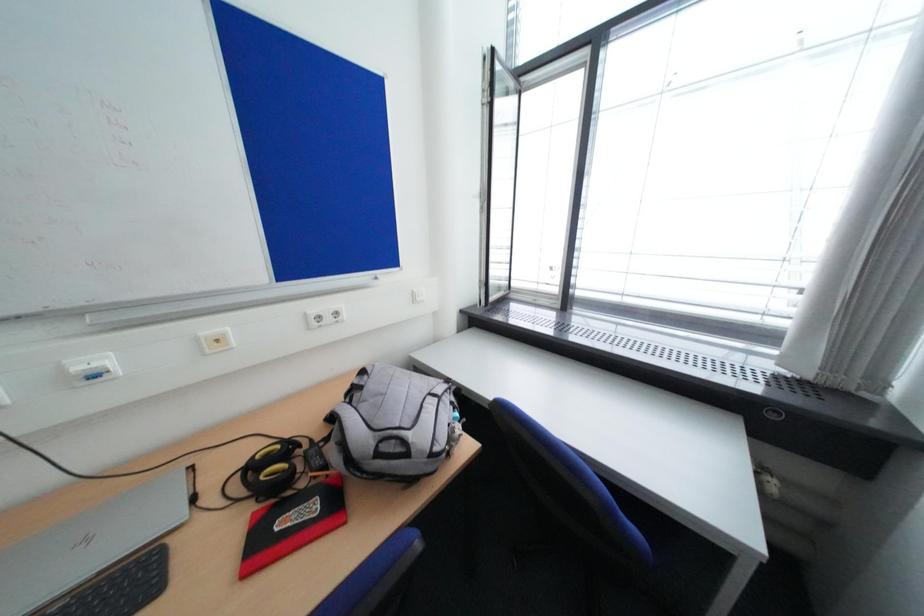
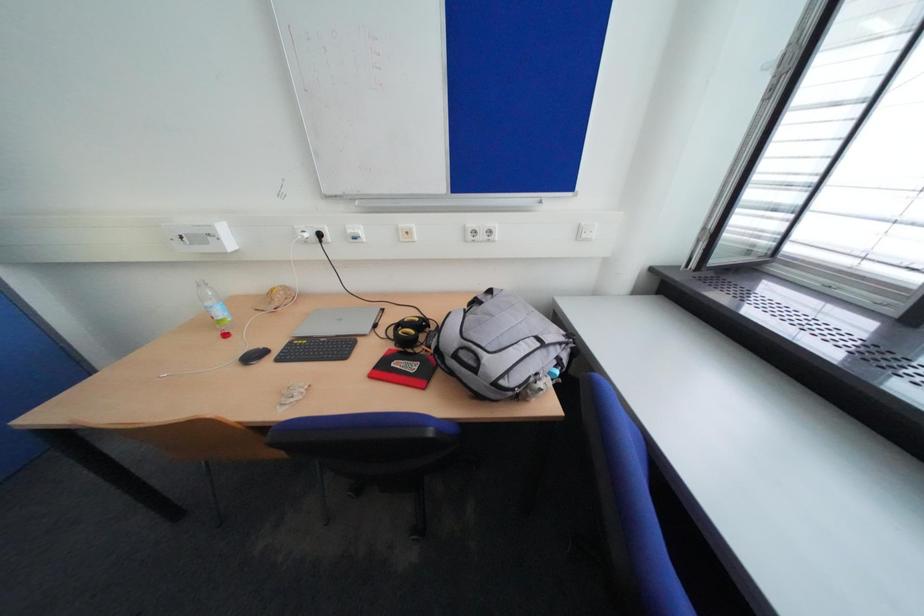
Based on the photo, based on the continuous images, in which direction is the camera rotating?

The camera rotated toward left-down.